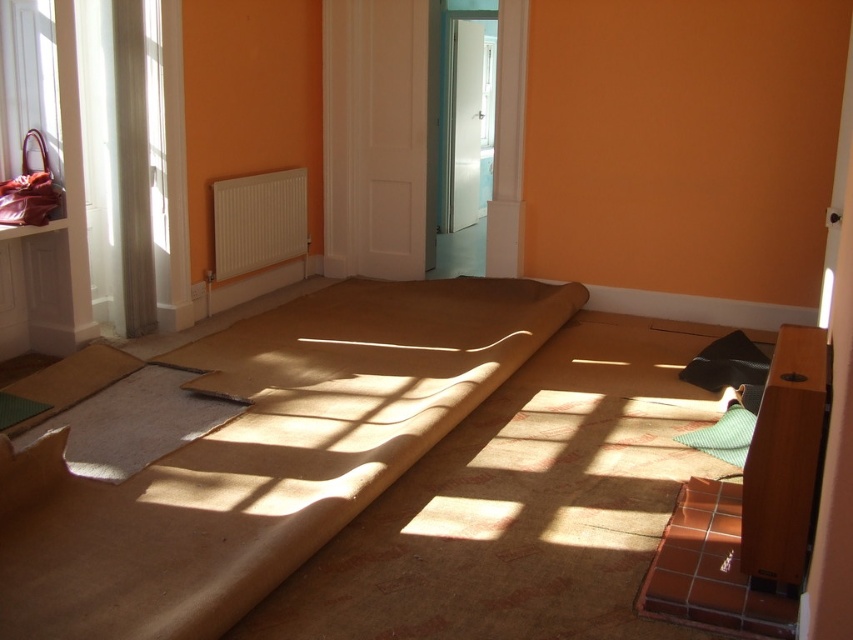
You are standing at the entrance of the room and want to place a new decorative item exactly at the center of the room. However, there is already a light gray felt mat at center. Where is the light gray felt mat located in relation to the room?

The light gray felt mat at center is located at point 0.661 along the horizontal axis and 0.157 along the vertical axis of the room.

You are standing in the middle of the room and want to locate the white plastic radiator at center. According to the coordinates provided, in which direction should you move to find it?

The white plastic radiator at center is located at coordinates point (x=258, y=221). Since you are standing in the middle of the room, you should move towards the lower left direction to reach it.

You are standing in the middle of the room and see the point marked at coordinates (258,221). What object is located at that point?

The point at (258,221) indicates the location of the white plastic radiator at center.